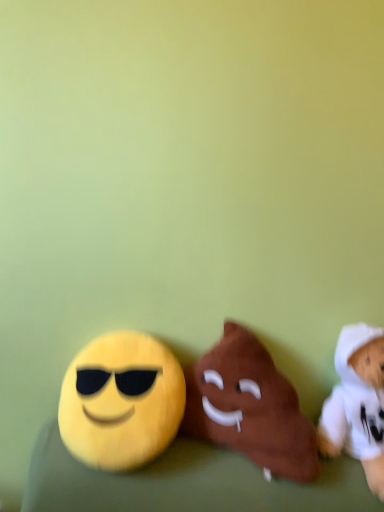
Question: Should I look upward or downward to see brown plush poop at center, arranged as the second toy when viewed from the right?

Choices:
 (A) down
 (B) up

Answer: (A)

Question: From the image's perspective, is yellow plush at left, the third toy positioned from the right, on top of white plush toy at right, arranged as the 3th toy when viewed from the left?

Choices:
 (A) no
 (B) yes

Answer: (B)

Question: Does yellow plush at left, the first toy from the left, lie in front of white plush toy at right, arranged as the 3th toy when viewed from the left?

Choices:
 (A) yes
 (B) no

Answer: (B)

Question: From a real-world perspective, is yellow plush at left, the third toy positioned from the right, positioned over white plush toy at right, arranged as the 3th toy when viewed from the left, based on gravity?

Choices:
 (A) no
 (B) yes

Answer: (A)

Question: Are yellow plush at left, the first toy from the left, and white plush toy at right, arranged as the 3th toy when viewed from the left, far apart?

Choices:
 (A) no
 (B) yes

Answer: (A)

Question: Is yellow plush at left, the third toy positioned from the right, turned away from white plush toy at right, arranged as the 3th toy when viewed from the left?

Choices:
 (A) no
 (B) yes

Answer: (A)

Question: Could you tell me if yellow plush at left, the first toy from the left, is turned towards white plush toy at right, the first toy viewed from the right?

Choices:
 (A) yes
 (B) no

Answer: (B)

Question: From a real-world perspective, does yellow plush at left, the third toy positioned from the right, stand above brown plush poop at center, which is the 2th toy in left-to-right order?

Choices:
 (A) no
 (B) yes

Answer: (A)

Question: Is yellow plush at left, the third toy positioned from the right, not close to brown plush poop at center, arranged as the second toy when viewed from the right?

Choices:
 (A) no
 (B) yes

Answer: (A)

Question: Considering the relative sizes of yellow plush at left, the third toy positioned from the right, and brown plush poop at center, which is the 2th toy in left-to-right order, in the image provided, is yellow plush at left, the third toy positioned from the right, bigger than brown plush poop at center, which is the 2th toy in left-to-right order,?

Choices:
 (A) yes
 (B) no

Answer: (B)

Question: Considering the relative sizes of yellow plush at left, the third toy positioned from the right, and brown plush poop at center, which is the 2th toy in left-to-right order, in the image provided, is yellow plush at left, the third toy positioned from the right, smaller than brown plush poop at center, which is the 2th toy in left-to-right order,?

Choices:
 (A) no
 (B) yes

Answer: (B)

Question: Can you confirm if yellow plush at left, the first toy from the left, is shorter than brown plush poop at center, which is the 2th toy in left-to-right order?

Choices:
 (A) yes
 (B) no

Answer: (A)

Question: Are yellow plush at left, the third toy positioned from the right, and brown plush poop at center, arranged as the second toy when viewed from the right, making contact?

Choices:
 (A) yes
 (B) no

Answer: (B)

Question: Is brown plush poop at center, which is the 2th toy in left-to-right order, taller than white plush toy at right, arranged as the 3th toy when viewed from the left?

Choices:
 (A) yes
 (B) no

Answer: (B)